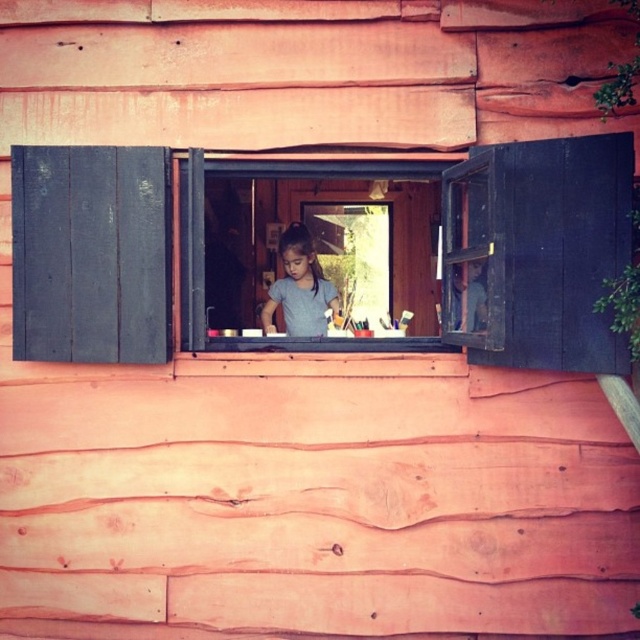
Question: Which is farther from the dark gray wood shutter at left?

Choices:
 (A) gray matte shirt at center
 (B) wooden window at center

Answer: (B)

Question: Is wooden window at center to the left of gray matte shirt at center from the viewer's perspective?

Choices:
 (A) no
 (B) yes

Answer: (A)

Question: Which point is closer to the camera?

Choices:
 (A) (186, 240)
 (B) (266, 304)
 (C) (13, 157)

Answer: (C)

Question: Does wooden window at center appear under dark gray wood shutter at left?

Choices:
 (A) no
 (B) yes

Answer: (A)

Question: Is wooden window at center smaller than dark gray wood shutter at left?

Choices:
 (A) yes
 (B) no

Answer: (B)

Question: Which point is closer to the camera?

Choices:
 (A) (316, 268)
 (B) (120, 330)

Answer: (B)